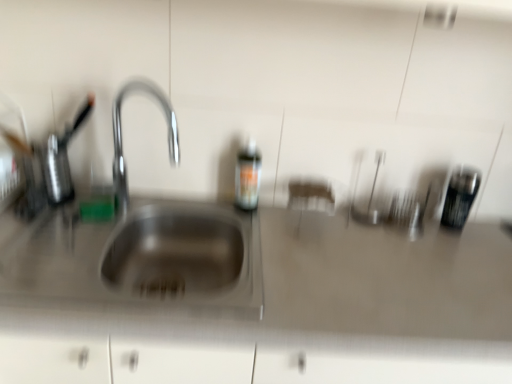
Locate an element on the screen. Image resolution: width=512 pixels, height=384 pixels. free space in front of translucent plastic bottle at center is located at coordinates (264, 234).